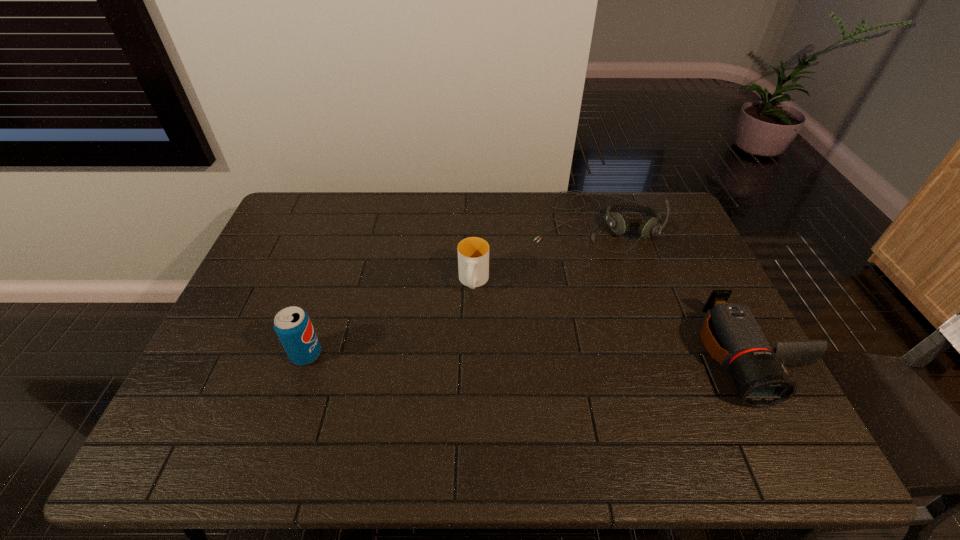
This screenshot has height=540, width=960. Find the location of `free space on the desktop that is between the leftmost object and the camcorder and is positioned on the outer surface of the headset`. free space on the desktop that is between the leftmost object and the camcorder and is positioned on the outer surface of the headset is located at coordinates (574, 355).

Locate an element on the screen. The width and height of the screenshot is (960, 540). free spot on the desktop that is between the tallest object and the camcorder and is positioned with the handle on the side of the cup is located at coordinates (464, 355).